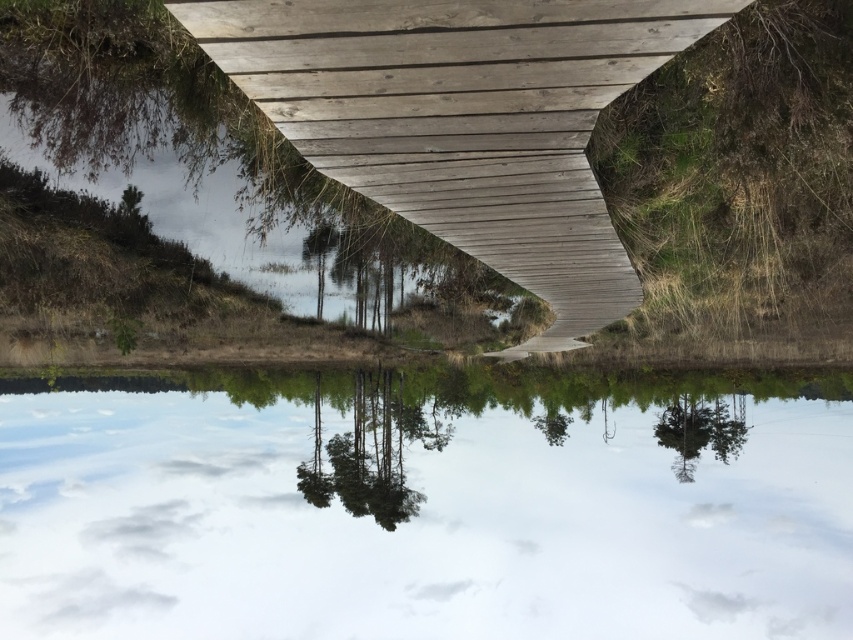
You are standing on the wooden pathway and want to cross to the other side. The transparent glass river at center is directly below you. Is the glass river at the exact center point of the pathway?

The transparent glass river at center is located at point (x=419, y=506), which is not exactly the center of the pathway. Therefore, the glass river is not at the exact center point of the pathway.

You are a hiker walking along the wooden pathway and want to cross the transparent glass river at center. To your right, there is a green matte tree at lower right. Which object is closer to you as you stand on the pathway?

The green matte tree at lower right is closer to you than the transparent glass river at center because the transparent glass river at center is taller than the green matte tree at lower right, indicating it is further away.